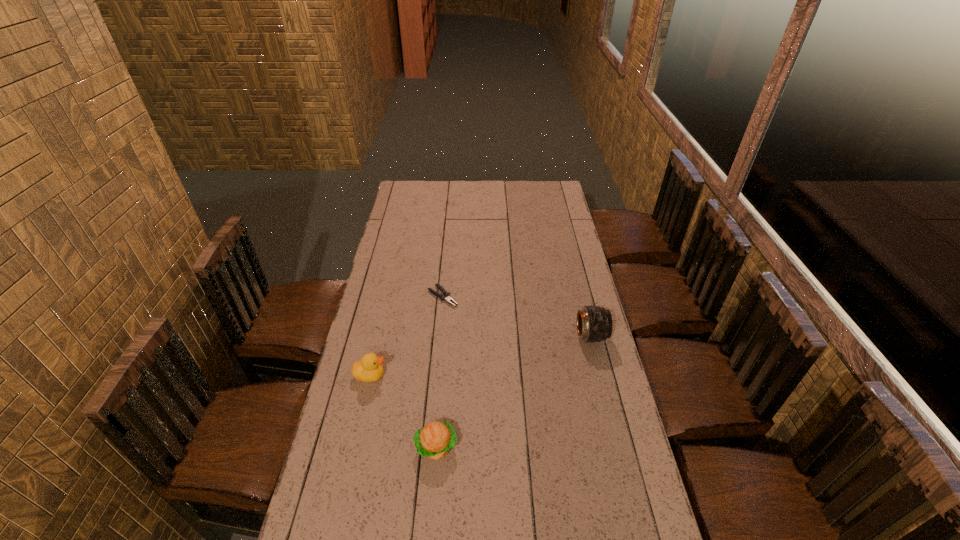
Where is `vacant region located 0.280m at the gripping part of the pliers`? vacant region located 0.280m at the gripping part of the pliers is located at coordinates (503, 344).

Identify the location of vacant space located on the face of the leftmost object. (403, 378).

Where is `free region located on the face of the leftmost object`? free region located on the face of the leftmost object is located at coordinates (418, 379).

I want to click on vacant region located 0.220m on the face of the leftmost object, so click(x=450, y=382).

The width and height of the screenshot is (960, 540). I want to click on object positioned at the left edge, so click(369, 369).

Image resolution: width=960 pixels, height=540 pixels. Find the location of `object that is at the right edge`. object that is at the right edge is located at coordinates (594, 324).

In the image, there is a desktop. At what (x,y) coordinates should I click in order to perform the action: click on vacant area at the far edge. Please return your answer as a coordinate pair (x, y). This screenshot has width=960, height=540. Looking at the image, I should click on click(512, 185).

Locate an element on the screen. vacant space at the left edge is located at coordinates (x=351, y=375).

The image size is (960, 540). I want to click on vacant space at the right edge of the desktop, so click(x=590, y=368).

Locate an element on the screen. This screenshot has width=960, height=540. free spot between the hamburger and the shortest object is located at coordinates (440, 372).